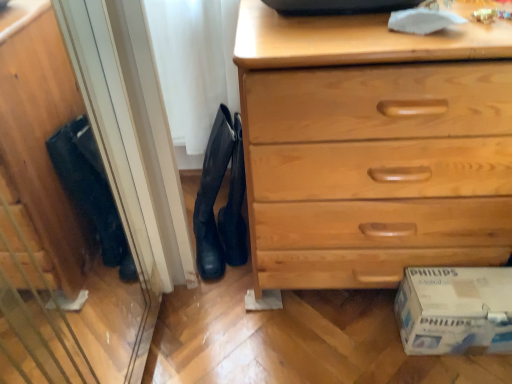
This screenshot has width=512, height=384. What are the coordinates of `free space in front of black leather boots at center` in the screenshot? It's located at (232, 302).